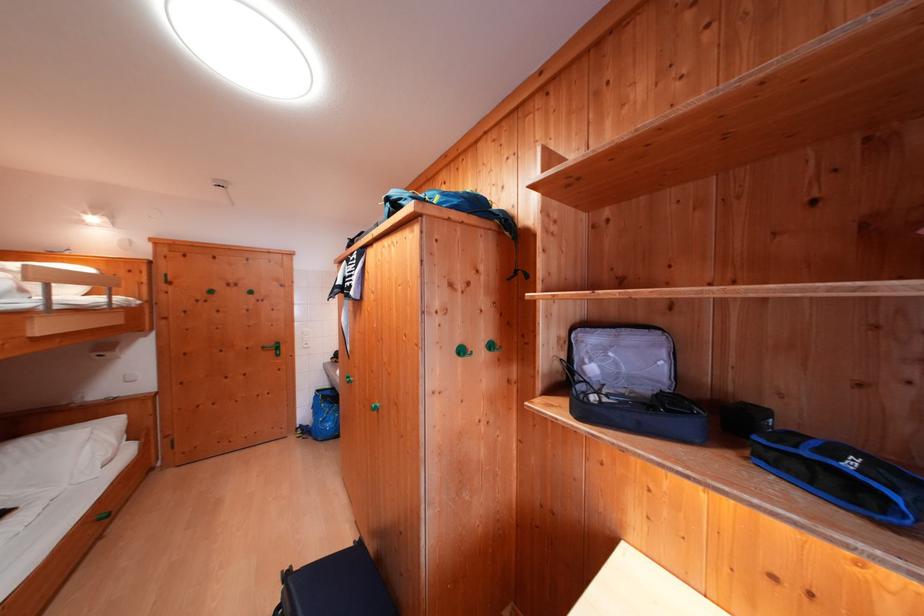
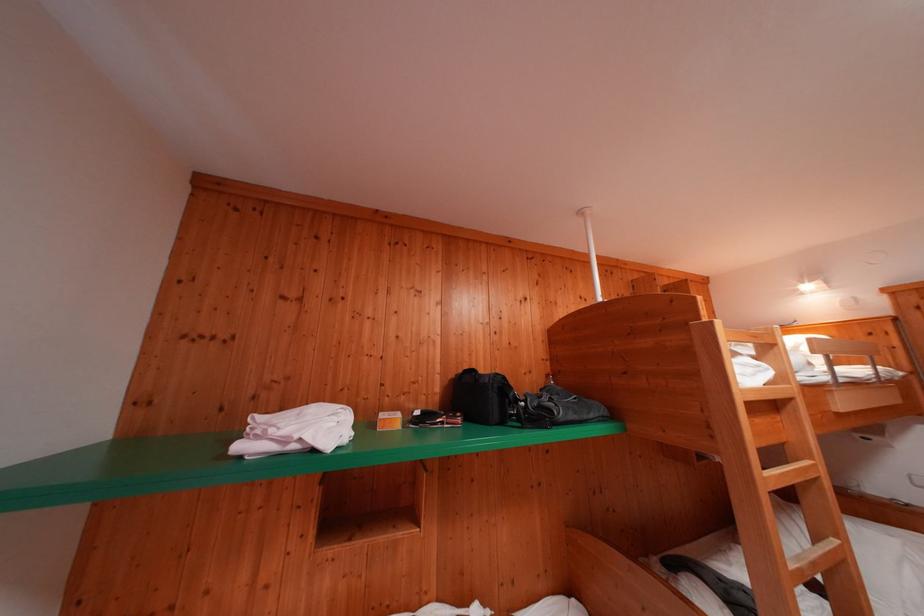
Question: The camera is either moving clockwise (left) or counter-clockwise (right) around the object. The first image is from the beginning of the video and the second image is from the end. Is the camera moving left or right when shooting the video?

Choices:
 (A) Left
 (B) Right

Answer: (B)